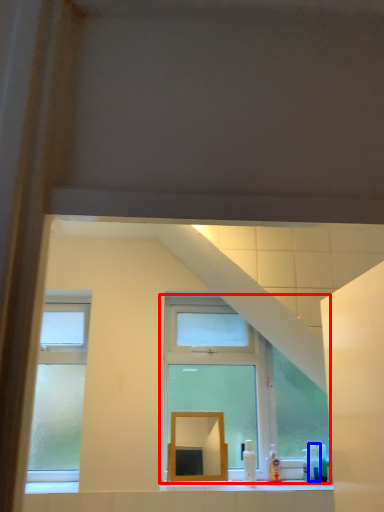
Question: Which object is closer to the camera taking this photo, window (highlighted by a red box) or toiletry (highlighted by a blue box)?

Choices:
 (A) window
 (B) toiletry

Answer: (A)